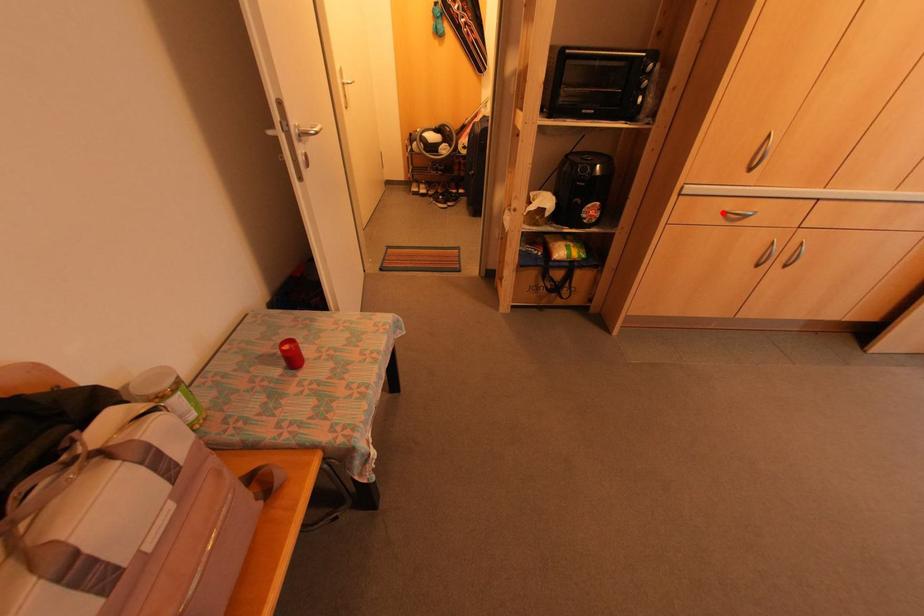
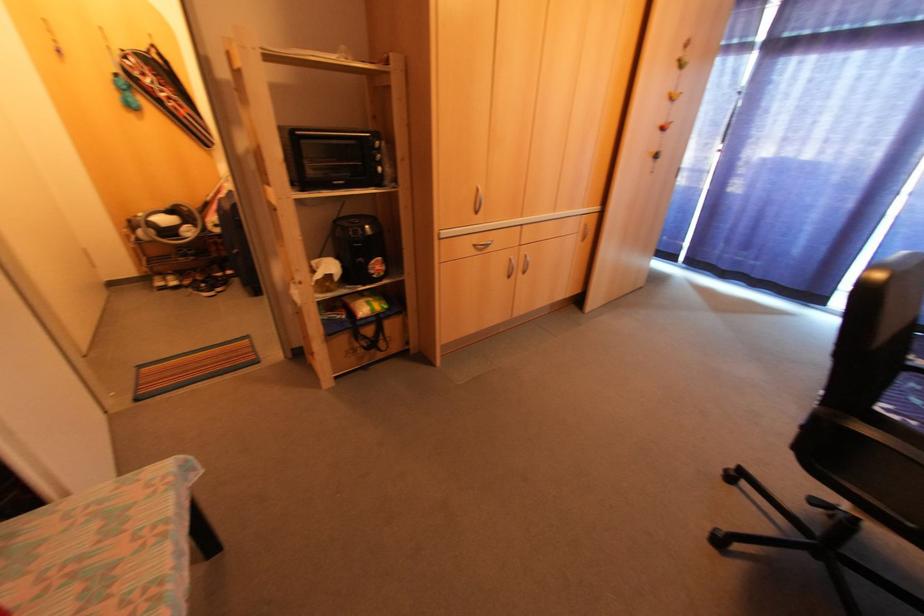
Locate, in the second image, the point that corresponds to the highlighted location in the first image.

(472, 246)